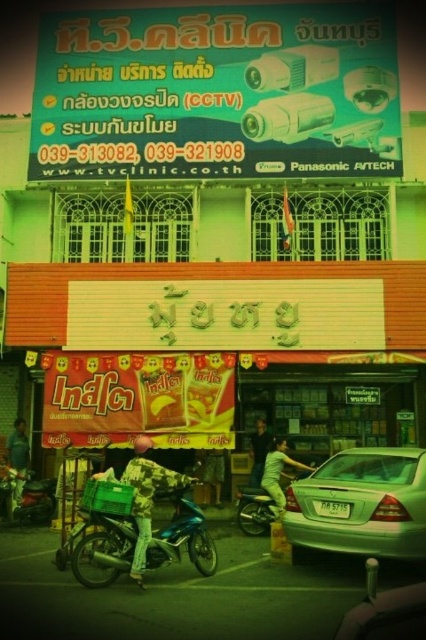
You are standing in front of the TV Clinic building and want to know the distance to the point marked at coordinates point (141, 540). Can you estimate how far it is?

The point (141, 540) is 42.90 meters away from the viewer.

You are a delivery person who needs to place a large package on the sidewalk. The package is taller than the metallic blue motorcycle at lower left. Can you safely place the package where the camouflage fabric jacket at center is currently located?

The camouflage fabric jacket at center is much taller than the metallic blue motorcycle at lower left. Since the package is taller than the motorcycle, it would also be taller than the jacket, so placing it where the jacket is might not be safe due to the height difference.